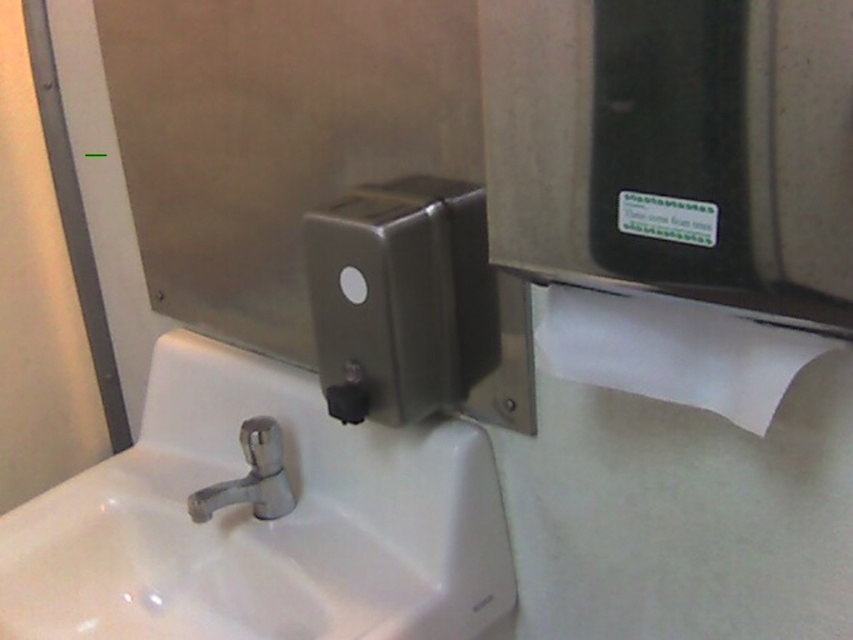
You are a maintenance worker inspecting the restroom facilities. You need to replace the satin nickel dispenser at center and the chrome metallic faucet at center. Which object requires a larger replacement part?

The satin nickel dispenser at center requires a larger replacement part since it is larger in size than the chrome metallic faucet at center.

You are a maintenance worker checking the restroom facilities. You need to ensure that the white glossy sink at lower left and the chrome metallic faucet at center are in proper working condition. Which of these two objects is larger in size?

The white glossy sink at lower left is bigger than the chrome metallic faucet at center according to the description.